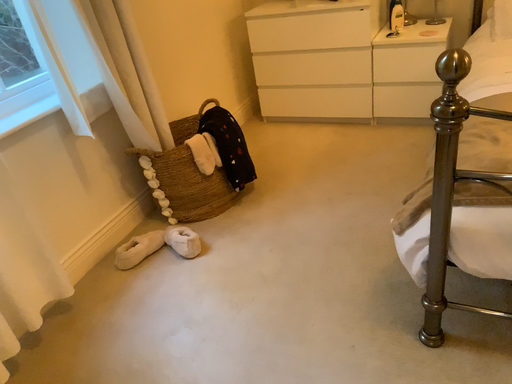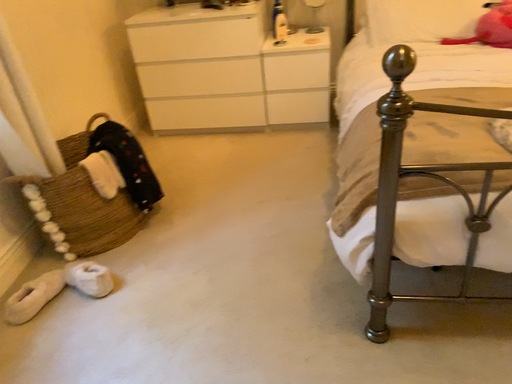
Question: Which way did the camera rotate in the video?

Choices:
 (A) rotated right
 (B) rotated left

Answer: (A)